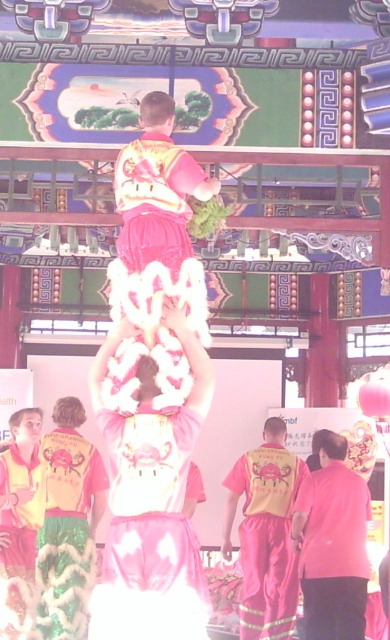
Is pink fabric at center bigger than green sequined fabric at lower left?

Yes, pink fabric at center is bigger than green sequined fabric at lower left.

Can you confirm if pink fabric at center is shorter than green sequined fabric at lower left?

In fact, pink fabric at center may be taller than green sequined fabric at lower left.

Which is in front, point (363, 550) or point (60, 520)?

Point (363, 550)

Find the location of a particular element. The height and width of the screenshot is (640, 390). pink fabric at center is located at coordinates (333, 545).

Measure the distance between point (x=154, y=456) and camera.

50.44 meters

Consider the image. Is pink satin costume at center to the right of pink fabric at center from the viewer's perspective?

In fact, pink satin costume at center is to the left of pink fabric at center.

Is point (120, 499) behind point (340, 608)?

No, it is in front of (340, 608).

Where is `pink satin costume at center`? pink satin costume at center is located at coordinates (148, 532).

Between pink fabric at center and yellow reflective fabric pants at center, which one appears on the right side from the viewer's perspective?

pink fabric at center

From the picture: Between pink fabric at center and yellow reflective fabric pants at center, which one appears on the left side from the viewer's perspective?

yellow reflective fabric pants at center is more to the left.

Is point (342, 570) farther from camera compared to point (230, 474)?

No.

Find the location of a particular element. This screenshot has height=640, width=390. pink fabric at center is located at coordinates (333, 545).